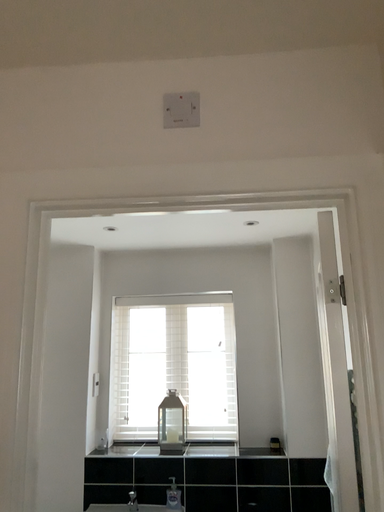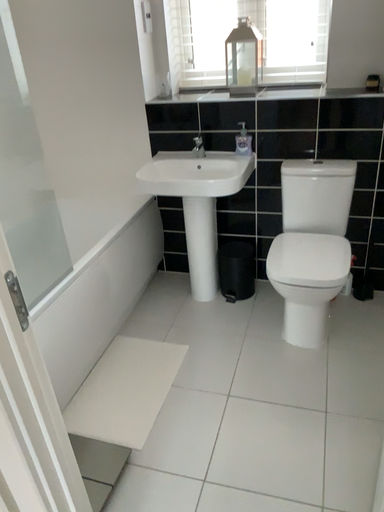
Question: How did the camera likely rotate when shooting the video?

Choices:
 (A) rotated right
 (B) rotated left

Answer: (B)